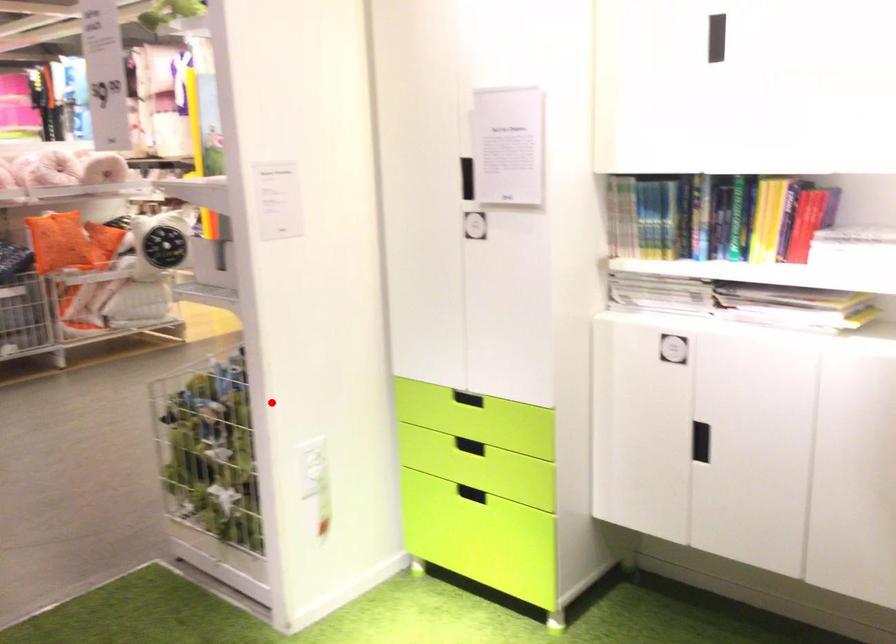
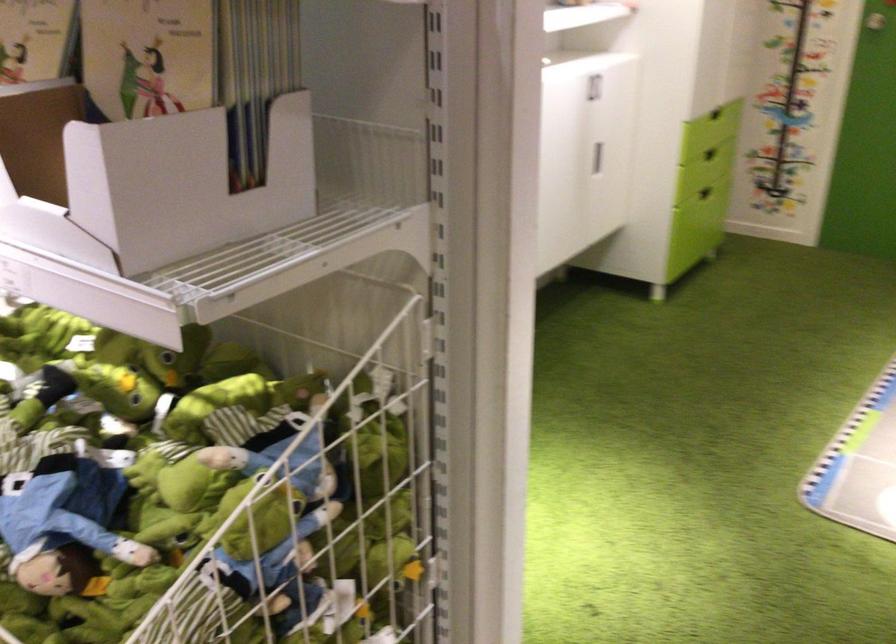
In the second image, find the point that corresponds to the highlighted location in the first image.

(376, 431)